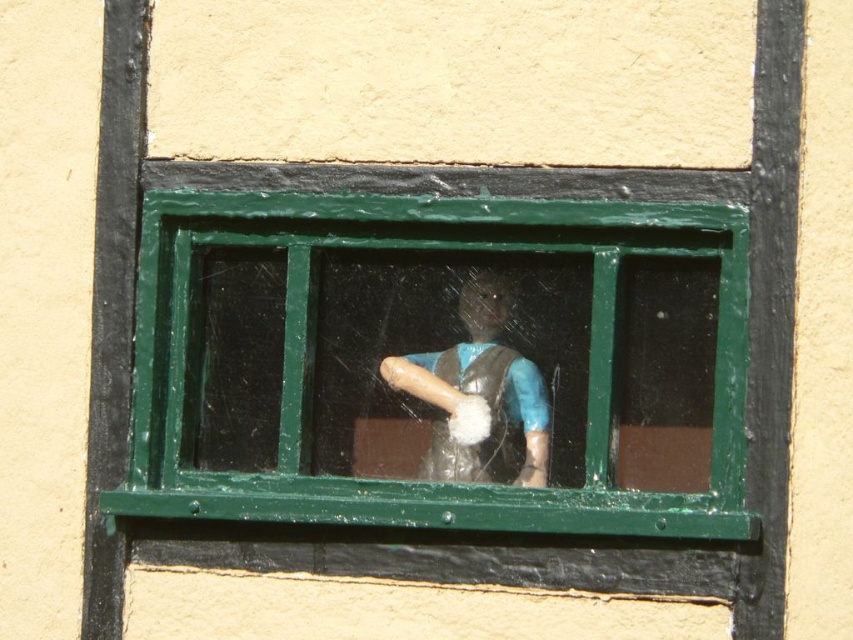
Consider the image. Is green painted wood window at center thinner than wooden rolling pin at center?

No, green painted wood window at center is not thinner than wooden rolling pin at center.

Does green painted wood window at center have a greater width compared to wooden rolling pin at center?

Indeed, green painted wood window at center has a greater width compared to wooden rolling pin at center.

Locate an element on the screen. The height and width of the screenshot is (640, 853). green painted wood window at center is located at coordinates (317, 358).

Who is positioned more to the right, matte plastic figurine at center or wooden rolling pin at center?

matte plastic figurine at center

Where is `matte plastic figurine at center`? matte plastic figurine at center is located at coordinates (479, 394).

Can you confirm if green painted wood window at center is positioned to the left of matte plastic figurine at center?

Correct, you'll find green painted wood window at center to the left of matte plastic figurine at center.

Between green painted wood window at center and matte plastic figurine at center, which one is positioned lower?

matte plastic figurine at center is lower down.

I want to click on green painted wood window at center, so pos(317,358).

Find the location of a particular element. green painted wood window at center is located at coordinates (317, 358).